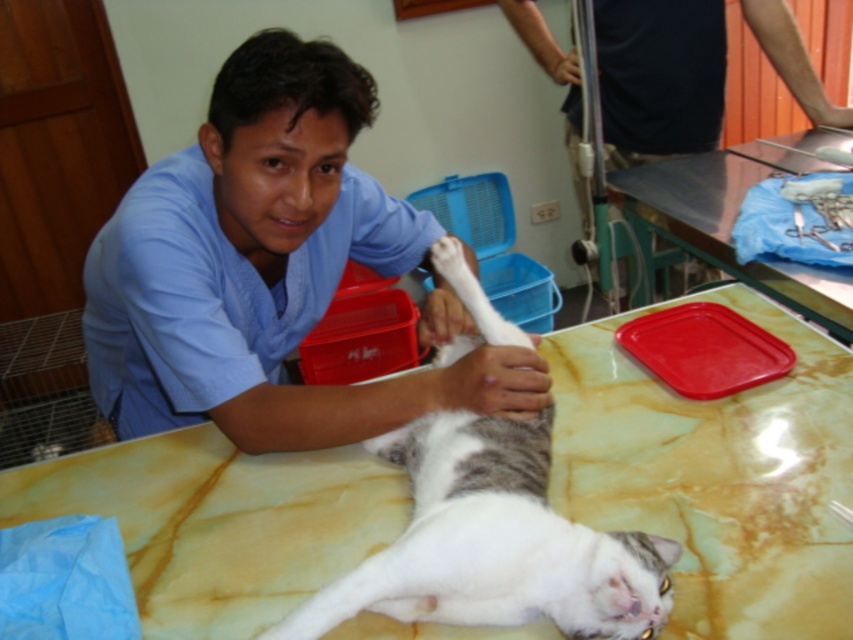
You are standing at the camera position looking at the veterinary table. There is a point at coordinates point (630, 60). Can you reach this point with a 6.5 foot long pole without moving your position?

The point at coordinates point (630, 60) is 6.44 feet away from the camera. Since the pole is 6.5 feet long, you can just barely reach it with the pole without moving your position.

You are a new veterinary assistant entering the clinic and need to place a small medical kit on the table. The table has limited space. Which object, the blue scrubs at upper left or the red plastic tray at upper right, would allow more space for the medical kit?

The blue scrubs at upper left occupies less space than the red plastic tray at upper right, so placing the medical kit next to the blue scrubs at upper left would leave more space.